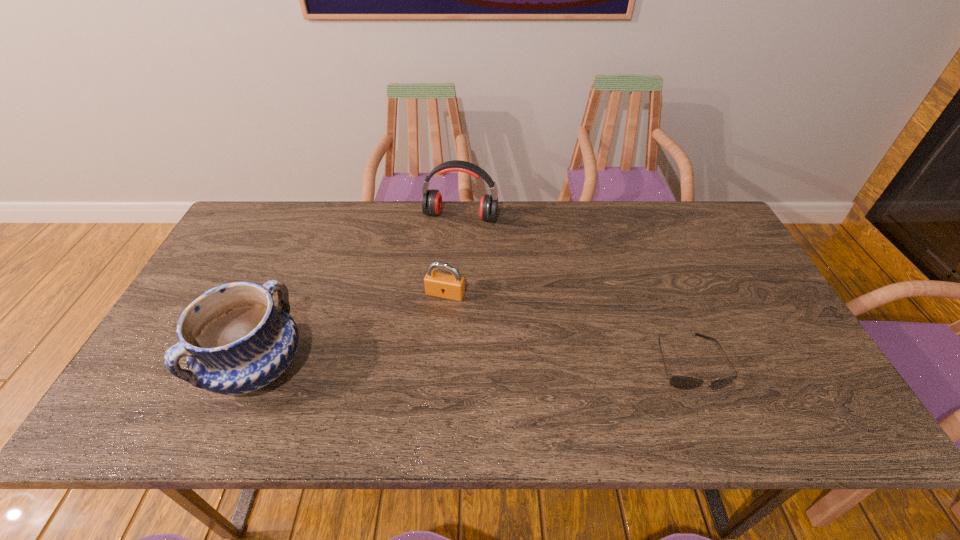
You are a GUI agent. You are given a task and a screenshot of the screen. Output one action in this format:
    pyautogui.click(x=<x>, y=<y>)
    Task: Click on the vacant space on the desktop that is between the leftmost object and the rightmost object and is positioned to unlock the third nearest object from the front
    The height and width of the screenshot is (540, 960).
    Given the screenshot: What is the action you would take?
    pyautogui.click(x=416, y=365)

Where is `free spot on the desktop that is between the pottery and the sunglasses and is positioned on the ear cups of the farthest object`? Image resolution: width=960 pixels, height=540 pixels. free spot on the desktop that is between the pottery and the sunglasses and is positioned on the ear cups of the farthest object is located at coordinates (414, 365).